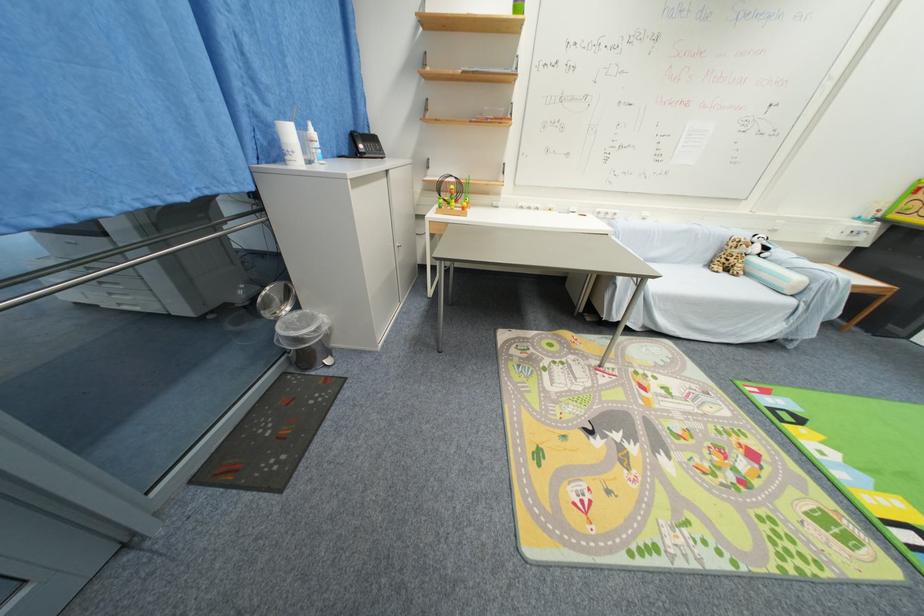
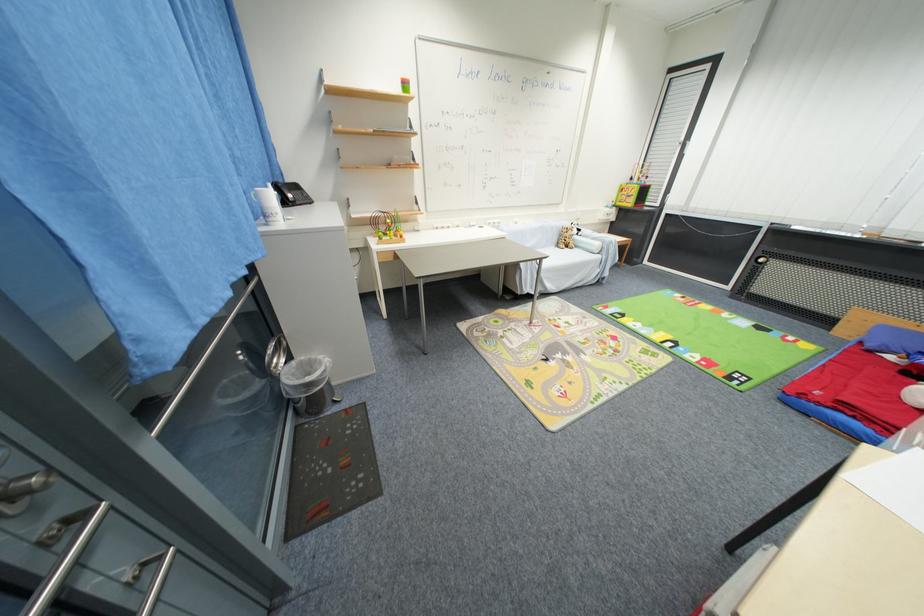
In the second image, find the point that corresponds to pixel 714 265 in the first image.

(563, 246)